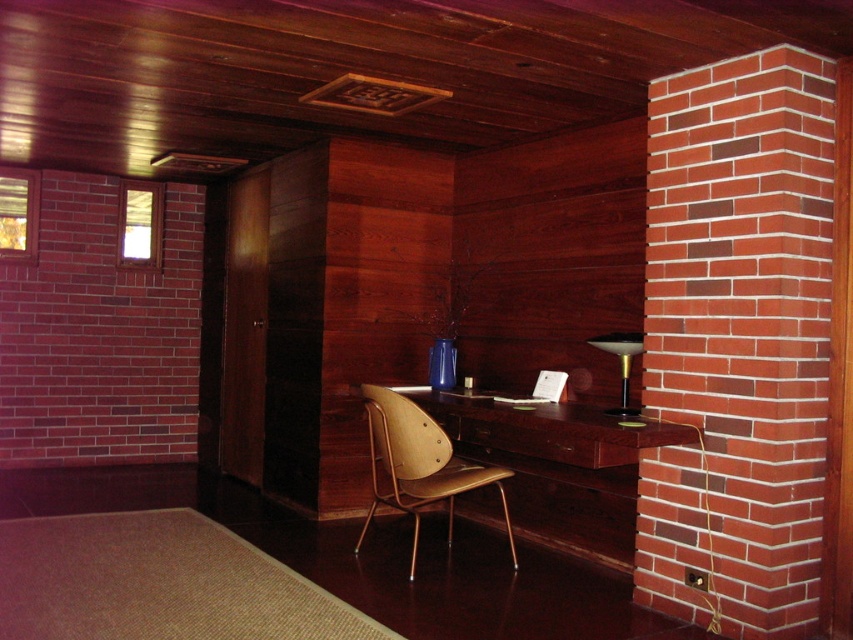
Between matte wood chair at center and matte gold lamp at right, which one has less height?

With less height is matte gold lamp at right.

Is matte wood chair at center to the right of matte gold lamp at right from the viewer's perspective?

Incorrect, matte wood chair at center is not on the right side of matte gold lamp at right.

This screenshot has height=640, width=853. What do you see at coordinates (419, 464) in the screenshot?
I see `matte wood chair at center` at bounding box center [419, 464].

Find the location of a particular element. This screenshot has width=853, height=640. matte wood chair at center is located at coordinates (419, 464).

Who is higher up, brown wood desk at center or matte wood chair at center?

brown wood desk at center is above.

From the picture: Can you confirm if brown wood desk at center is bigger than matte wood chair at center?

Yes.

The image size is (853, 640). What do you see at coordinates (521, 461) in the screenshot? I see `brown wood desk at center` at bounding box center [521, 461].

The height and width of the screenshot is (640, 853). What are the coordinates of `brown wood desk at center` in the screenshot? It's located at coord(521,461).

Does brown wood desk at center have a greater width compared to matte gold lamp at right?

Correct, the width of brown wood desk at center exceeds that of matte gold lamp at right.

Is point (561, 413) positioned after point (630, 332)?

No.

The width and height of the screenshot is (853, 640). In order to click on brown wood desk at center in this screenshot , I will do `click(521, 461)`.